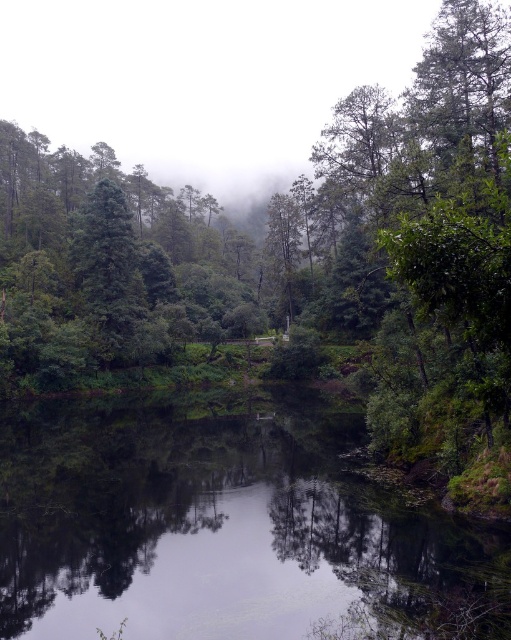
You are an artist trying to paint this scene. You have two main elements to focus on the green reflective water at center and the green matte tree at center. Which of these two elements should you paint first if you want to follow the principle of painting smaller objects before larger ones?

The green reflective water at center should be painted first because it has a smaller size compared to the green matte tree at center.

You are a hiker standing at the edge of the forest and see the green reflective water at center and the green matte tree at center. Which object is closer to the ground?

The green reflective water at center is located below the green matte tree at center, so it is closer to the ground.

You are a drone operator trying to capture the reflection of the trees in the green reflective water at center. According to the coordinates provided, where exactly should you position the drone to ensure the reflection is fully visible in the frame?

The green reflective water at center is located at coordinates point (220, 529), so positioning the drone at that point will ensure the reflection of the trees is fully visible in the frame.